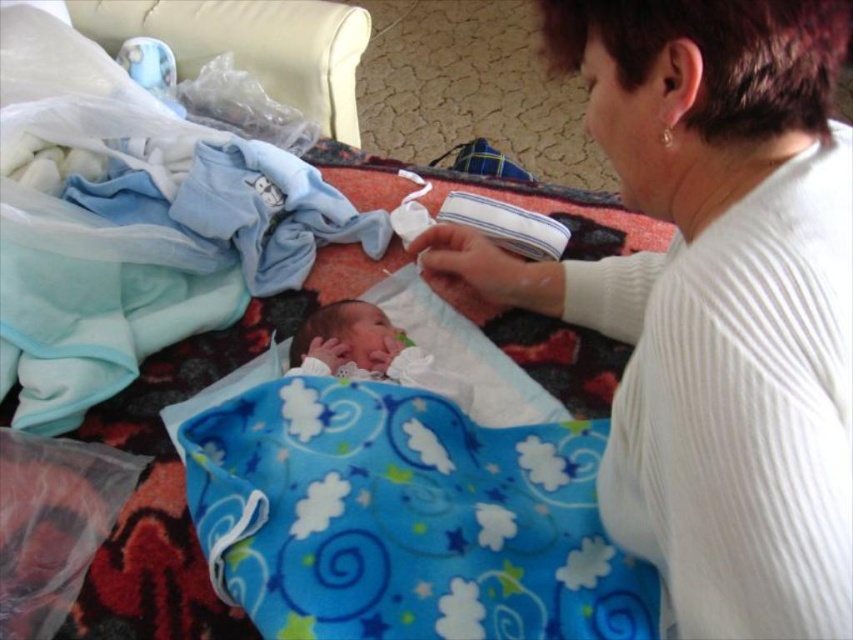
You are a photographer setting up a shot of the baby and the woman. You need to position a light source between the two points marked as point (608, 266) and point (384, 509). Which point should the light be closer to to ensure it illuminates the baby and the woman adequately?

The light should be placed closer to point (384, 509) because point (608, 266) is further away from the viewer, making the light closer to the nearer point would better illuminate both subjects evenly.

You are a photographer taking a closeup shot of the newborn baby. You want to ensure that the white ribbed sweater at upper right is not in the frame. Is it possible to do so without moving the sweater?

The white ribbed sweater at upper right is 14.19 inches away from the camera. Since this distance is fixed, you can adjust the camera angle or zoom to exclude the sweater from the frame without moving it.

You are a photographer setting up for a baby photoshoot. The blue fleece blanket at center is covering the soft white newborn at center. Can you confirm if the blanket is large enough to fully cover the newborn?

The blue fleece blanket at center has a width larger than the soft white newborn at center, so yes, the blanket is large enough to fully cover the newborn.